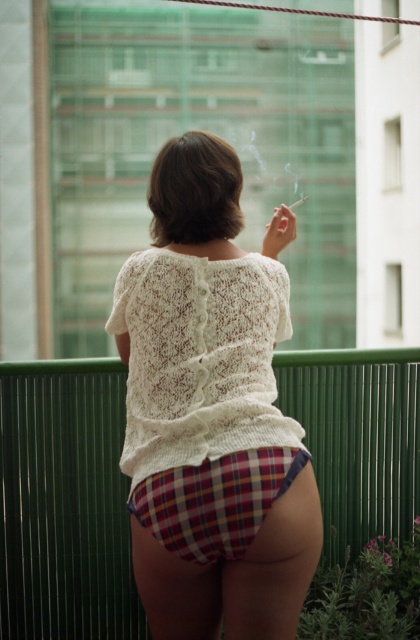
Between green metal fence at center and plaid fabric underwear at lower center, which one is positioned lower?

Positioned lower is green metal fence at center.

Does point (76, 429) come behind point (128, 508)?

Yes, it is behind point (128, 508).

Identify the location of green metal fence at center. The width and height of the screenshot is (420, 640). (65, 502).

Is white knitted sweater at center to the right of plaid fabric underwear at lower center from the viewer's perspective?

Yes, white knitted sweater at center is to the right of plaid fabric underwear at lower center.

Is white knitted sweater at center smaller than plaid fabric underwear at lower center?

No.

Find the location of `white knitted sweater at center`. white knitted sweater at center is located at coordinates (212, 412).

You are a GUI agent. You are given a task and a screenshot of the screen. Output one action in this format:
    pyautogui.click(x=<x>, y=<y>)
    Task: Click on the white knitted sweater at center
    Image resolution: width=420 pixels, height=640 pixels.
    Given the screenshot: What is the action you would take?
    pyautogui.click(x=212, y=412)

Is white knitted sweater at center shorter than green metal fence at center?

In fact, white knitted sweater at center may be taller than green metal fence at center.

Which of these two, white knitted sweater at center or green metal fence at center, stands taller?

Standing taller between the two is white knitted sweater at center.

This screenshot has width=420, height=640. Find the location of `white knitted sweater at center`. white knitted sweater at center is located at coordinates (212, 412).